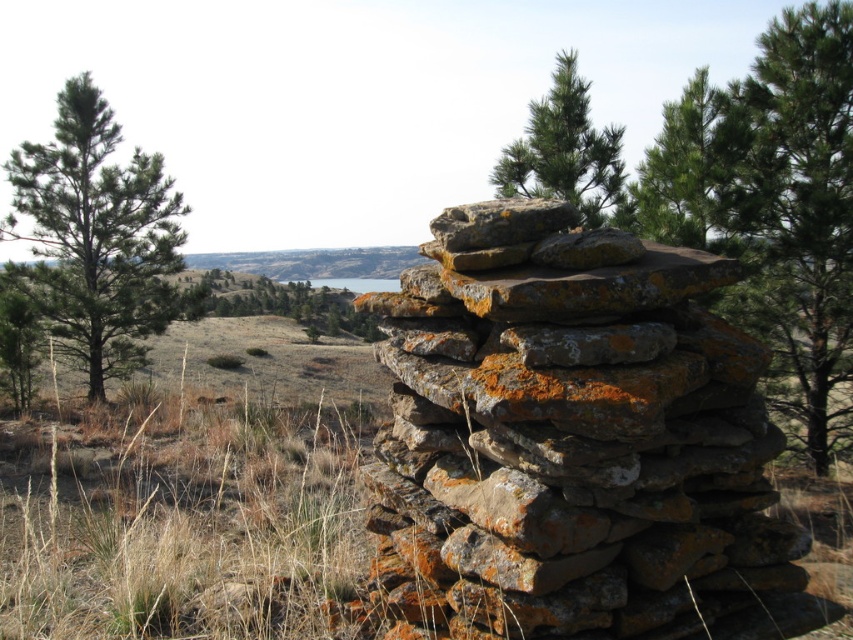
You are standing in front of the rusty stone stack at center. You want to take a photo of it with your smartphone, which has a minimum focus distance of 1.5 feet. Will you be able to take a clear photo without moving closer?

The distance between you and the rusty stone stack at center is 6.80 feet, which is greater than the smartphone camera minimum focus distance of 1.5 feet. Therefore, you can take a clear photo without moving closer.